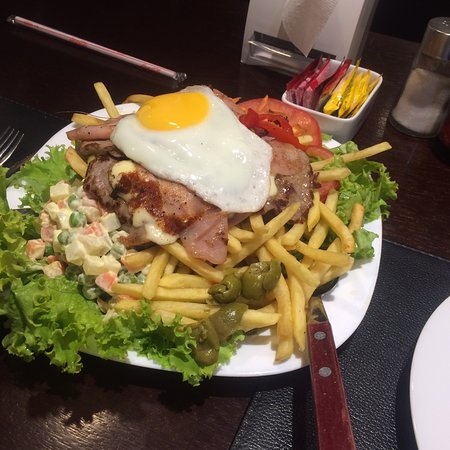
Locate an element on the screen. This screenshot has height=450, width=450. silver top of salt shaker is located at coordinates (442, 43).